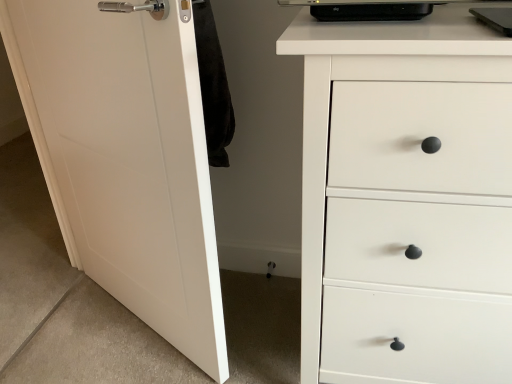
Question: Is white matte door at left spatially inside white matte chest of drawers at right, or outside of it?

Choices:
 (A) inside
 (B) outside

Answer: (B)

Question: Considering their positions, is white matte door at left located in front of or behind white matte chest of drawers at right?

Choices:
 (A) front
 (B) behind

Answer: (B)

Question: From the image's perspective, is white matte door at left above or below white matte chest of drawers at right?

Choices:
 (A) below
 (B) above

Answer: (B)

Question: Is white matte chest of drawers at right inside the boundaries of white matte door at left, or outside?

Choices:
 (A) inside
 (B) outside

Answer: (B)

Question: In terms of size, does white matte chest of drawers at right appear bigger or smaller than white matte door at left?

Choices:
 (A) big
 (B) small

Answer: (A)

Question: In the image, is white matte chest of drawers at right on the left side or the right side of white matte door at left?

Choices:
 (A) right
 (B) left

Answer: (A)

Question: From a real-world perspective, is white matte chest of drawers at right above or below white matte door at left?

Choices:
 (A) above
 (B) below

Answer: (B)